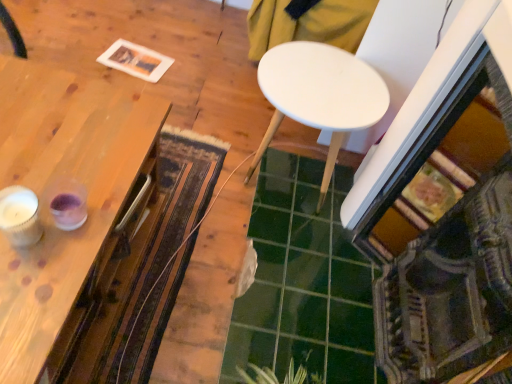
Where is `vacant space to the right of white textured candle at left`? The image size is (512, 384). vacant space to the right of white textured candle at left is located at coordinates (72, 248).